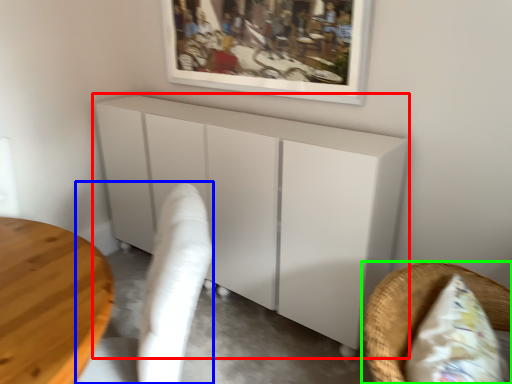
Question: Estimate the real-world distances between objects in this image. Which object is closer to furniture (highlighted by a red box), swivel chair (highlighted by a blue box) or furniture (highlighted by a green box)?

Choices:
 (A) swivel chair
 (B) furniture

Answer: (A)